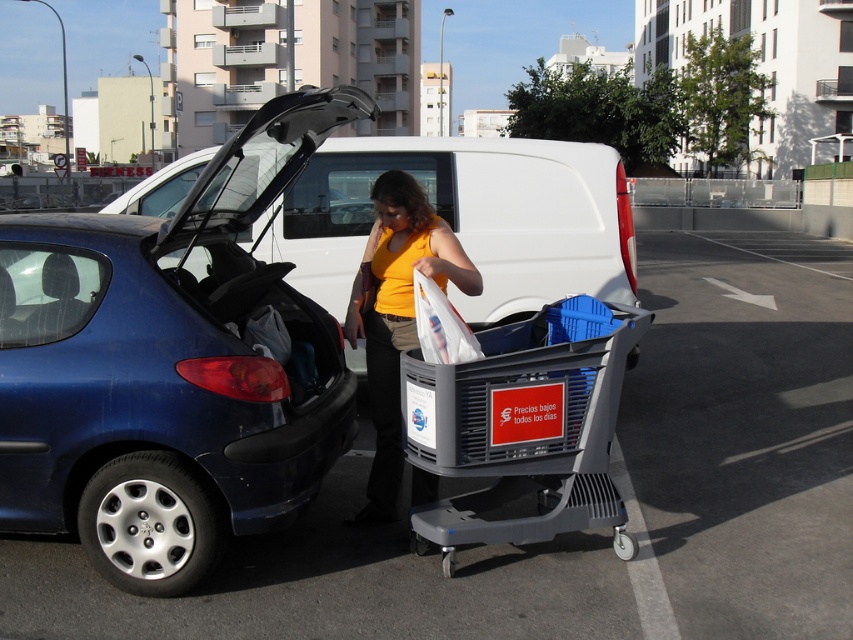
You are a delivery person trying to park your van in the parking lot. You see the metallic blue car at left and the gray plastic shopping cart at center. Which object is closer to the left side of the parking lot?

The metallic blue car at left is closer to the left side of the parking lot because it is positioned to the left of the gray plastic shopping cart at center.